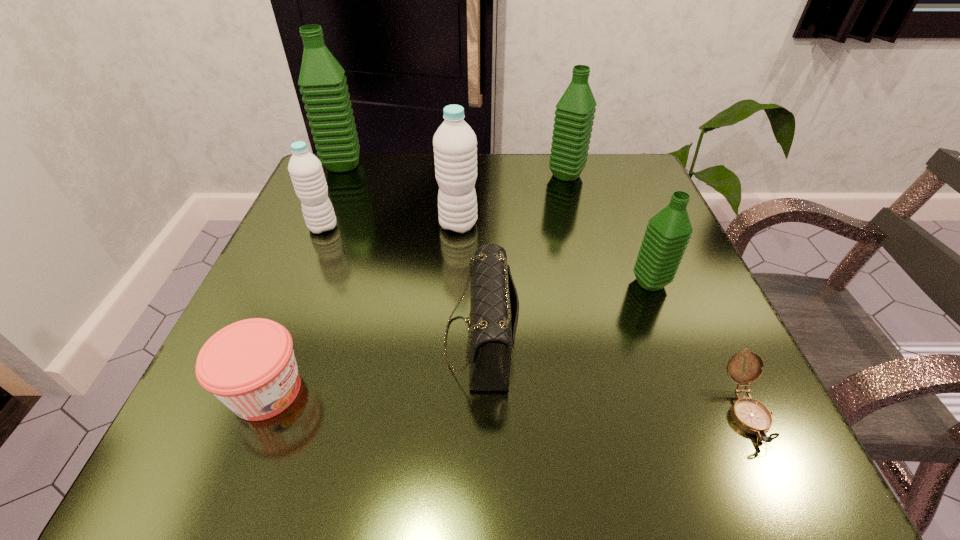
You are a GUI agent. You are given a task and a screenshot of the screen. Output one action in this format:
    pyautogui.click(x=<x>, y=<y>)
    Task: Click on the water bottle that can be found as the third closest to the second smallest green water bottle
    
    Given the screenshot: What is the action you would take?
    pyautogui.click(x=325, y=93)

Identify the location of green water bottle that is the closest to the clutch bag. (668, 232).

The image size is (960, 540). Find the location of `green water bottle that can be found as the closest to the bigger white water bottle`. green water bottle that can be found as the closest to the bigger white water bottle is located at coordinates (575, 110).

The height and width of the screenshot is (540, 960). In order to click on vacant space that satisfies the following two spatial constraints: 1. on the front side of the nearest green water bottle; 2. on the right side of the second smallest green water bottle in this screenshot , I will do `click(594, 282)`.